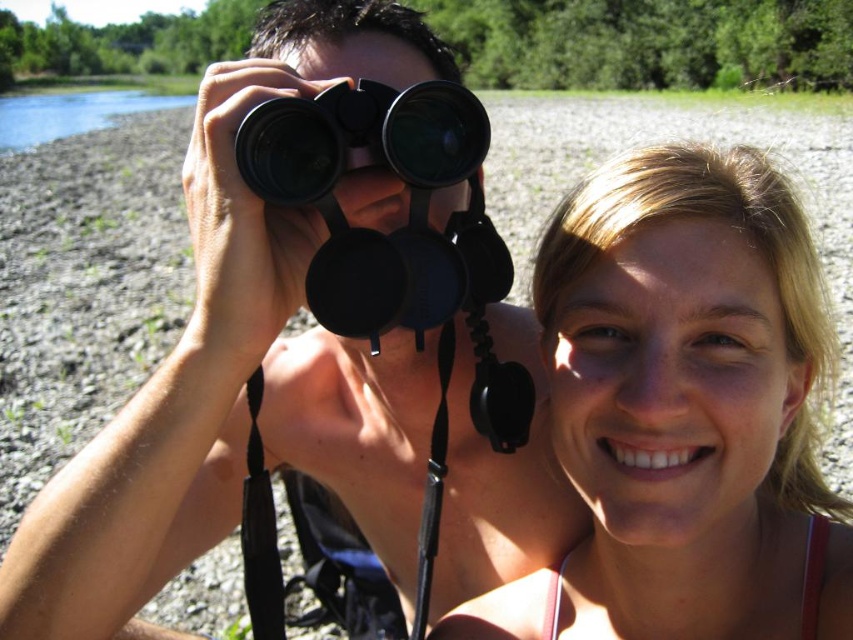
Who is more forward, (526, 316) or (486, 118)?

Point (486, 118) is in front.

Consider the image. Who is positioned more to the right, black matte binoculars at center or black rubber binoculars at center?

black rubber binoculars at center

What do you see at coordinates (241, 369) in the screenshot? I see `black matte binoculars at center` at bounding box center [241, 369].

Identify the location of black matte binoculars at center. (241, 369).

In the scene shown: Does black matte binoculars at center appear on the right side of blue water at upper left?

Correct, you'll find black matte binoculars at center to the right of blue water at upper left.

Which of these two, black matte binoculars at center or blue water at upper left, stands taller?

With more height is blue water at upper left.

Between point (49, 508) and point (83, 120), which one is positioned behind?

The point (83, 120) is behind.

You are a GUI agent. You are given a task and a screenshot of the screen. Output one action in this format:
    pyautogui.click(x=<x>, y=<y>)
    Task: Click on the black matte binoculars at center
    This screenshot has height=640, width=853.
    Given the screenshot: What is the action you would take?
    coord(241,369)

Can you confirm if blonde hair at center is positioned above black rubber binoculars at center?

No, blonde hair at center is not above black rubber binoculars at center.

Does point (718, 412) come farther from viewer compared to point (262, 163)?

That is True.

This screenshot has width=853, height=640. What are the coordinates of `blonde hair at center` in the screenshot? It's located at (683, 412).